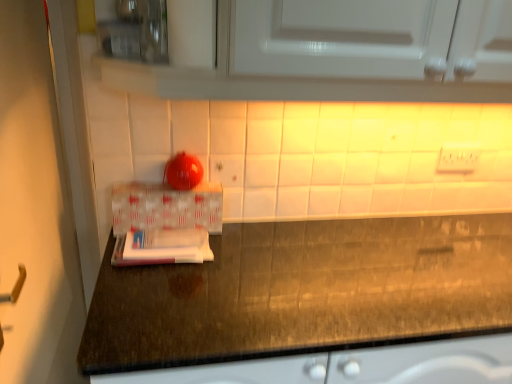
At what (x,y) coordinates should I click in order to perform the action: click on white plastic electric outlet at upper center. Please return your answer as a coordinate pair (x, y). Looking at the image, I should click on (459, 157).

Describe the element at coordinates (459, 157) in the screenshot. This screenshot has width=512, height=384. I see `white plastic electric outlet at upper center` at that location.

Identify the location of white woven box at center. The width and height of the screenshot is (512, 384). (166, 207).

This screenshot has width=512, height=384. Describe the element at coordinates (166, 207) in the screenshot. I see `white woven box at center` at that location.

Where is `white plastic electric outlet at upper center`? This screenshot has height=384, width=512. white plastic electric outlet at upper center is located at coordinates (459, 157).

Looking at this image, considering the relative positions of white plastic electric outlet at upper center and white woven box at center in the image provided, is white plastic electric outlet at upper center to the left or to the right of white woven box at center?

Clearly, white plastic electric outlet at upper center is on the right of white woven box at center in the image.

Relative to white woven box at center, is white plastic electric outlet at upper center in front or behind?

Clearly, white plastic electric outlet at upper center is behind white woven box at center.

Is point (452, 166) positioned in front of point (194, 189)?

That is False.

From the image's perspective, which one is positioned lower, white plastic electric outlet at upper center or white woven box at center?

white woven box at center, from the image's perspective.

From a real-world perspective, which object rests below the other?

From a 3D spatial view, white woven box at center is below.

Can you confirm if white plastic electric outlet at upper center is wider than white woven box at center?

No.

Can you confirm if white plastic electric outlet at upper center is shorter than white woven box at center?

Yes, white plastic electric outlet at upper center is shorter than white woven box at center.

Can you confirm if white plastic electric outlet at upper center is smaller than white woven box at center?

Correct, white plastic electric outlet at upper center occupies less space than white woven box at center.

Is white plastic electric outlet at upper center not within white woven box at center?

Yes.

Are white plastic electric outlet at upper center and white woven box at center located far from each other?

No, there isn't a large distance between white plastic electric outlet at upper center and white woven box at center.

Is white plastic electric outlet at upper center facing away from white woven box at center?

No, white plastic electric outlet at upper center is not facing the opposite direction of white woven box at center.

How many degrees apart are the facing directions of white plastic electric outlet at upper center and white woven box at center?

There is a 0.0212-degree angle between the facing directions of white plastic electric outlet at upper center and white woven box at center.

You are a GUI agent. You are given a task and a screenshot of the screen. Output one action in this format:
    pyautogui.click(x=<x>, y=<y>)
    Task: Click on the electric outlet that is above the white woven box at center (from a real-world perspective)
    The width and height of the screenshot is (512, 384).
    Given the screenshot: What is the action you would take?
    pyautogui.click(x=459, y=157)

Considering the positions of objects white woven box at center and white plastic electric outlet at upper center in the image provided, who is more to the right, white woven box at center or white plastic electric outlet at upper center?

Positioned to the right is white plastic electric outlet at upper center.

Between white woven box at center and white plastic electric outlet at upper center, which one is positioned in front?

Positioned in front is white woven box at center.

Is point (184, 208) positioned before point (452, 149)?

Yes, it is in front of point (452, 149).

From the image's perspective, is white woven box at center on white plastic electric outlet at upper center?

No, from the image's perspective, white woven box at center is not on top of white plastic electric outlet at upper center.

From a real-world perspective, is white woven box at center over white plastic electric outlet at upper center?

No, from a real-world perspective, white woven box at center is not on top of white plastic electric outlet at upper center.

Which object is wider, white woven box at center or white plastic electric outlet at upper center?

With larger width is white woven box at center.

Considering the sizes of objects white woven box at center and white plastic electric outlet at upper center in the image provided, who is shorter, white woven box at center or white plastic electric outlet at upper center?

With less height is white plastic electric outlet at upper center.

Between white woven box at center and white plastic electric outlet at upper center, which one has smaller size?

white plastic electric outlet at upper center is smaller.

Is white woven box at center completely or partially outside of white plastic electric outlet at upper center?

Yes, white woven box at center is outside of white plastic electric outlet at upper center.

Is white woven box at center with white plastic electric outlet at upper center?

There is a gap between white woven box at center and white plastic electric outlet at upper center.

Is white woven box at center looking in the opposite direction of white plastic electric outlet at upper center?

No.

How different are the orientations of white woven box at center and white plastic electric outlet at upper center in degrees?

They differ by 0.0212 degrees in their facing directions.

The height and width of the screenshot is (384, 512). Find the location of `electric outlet that appears behind the white woven box at center`. electric outlet that appears behind the white woven box at center is located at coordinates (459, 157).

The image size is (512, 384). In order to click on electric outlet behind the white woven box at center in this screenshot , I will do point(459,157).

Find the location of a particular element. electric outlet above the white woven box at center (from a real-world perspective) is located at coordinates (459, 157).